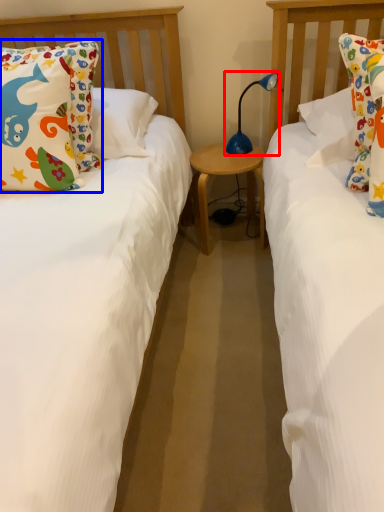
Question: Which object appears farthest to the camera in this image, table lamp (highlighted by a red box) or pillow (highlighted by a blue box)?

Choices:
 (A) table lamp
 (B) pillow

Answer: (A)